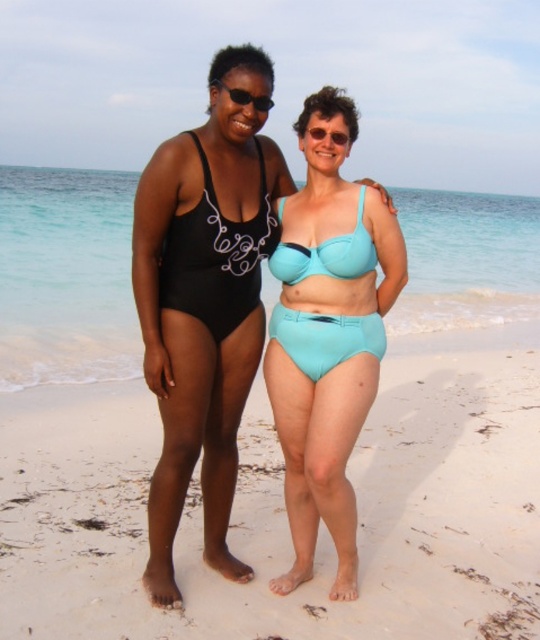
You are a lifeguard on duty and need to retrieve an object. You see the matte blue bikini at center and the transparent plastic goggles at center. Which object is closer to you?

The matte blue bikini at center is 28.91 inches away from transparent plastic goggles at center, so the distance between them is 28.91 inches. However, without knowing your exact position, I can only state their relative distance to each other. If you are positioned equidistant from both, then neither is closer. But if you are closer to one, that one would be nearer. The given information doesn not specify your location, so I can only provide their separation distance.

You are a beachcomber searching for hidden treasures on the beach. You notice both the white sand at center and the transparent plastic goggles at center. Which object is positioned to the left of the other?

The white sand at center is to the left of the transparent plastic goggles at center.